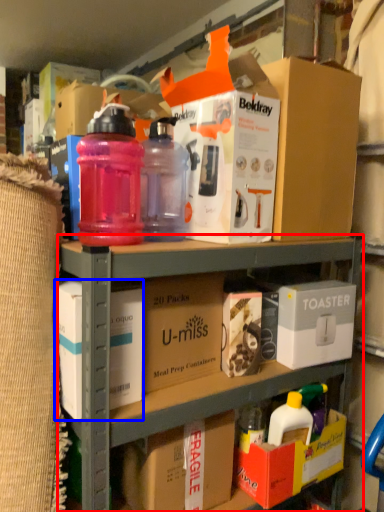
Question: Which point is further to the camera, shelf (highlighted by a red box) or box (highlighted by a blue box)?

Choices:
 (A) shelf
 (B) box

Answer: (B)